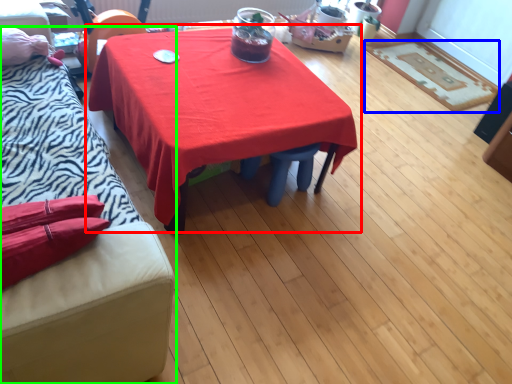
Question: Which object is the farthest from table (highlighted by a red box)? Choose among these: mat (highlighted by a blue box) or studio couch (highlighted by a green box).

Choices:
 (A) mat
 (B) studio couch

Answer: (A)